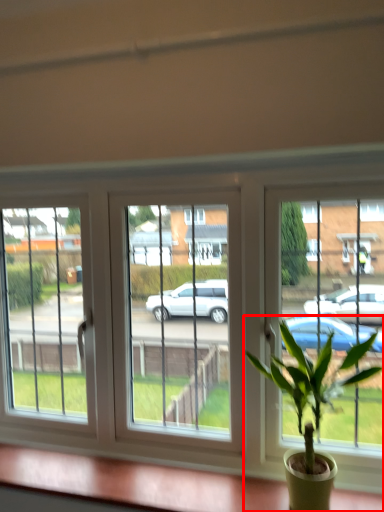
Question: Considering the relative positions of houseplant (annotated by the red box) and window sill in the image provided, where is houseplant (annotated by the red box) located with respect to the staircase?

Choices:
 (A) right
 (B) left

Answer: (A)